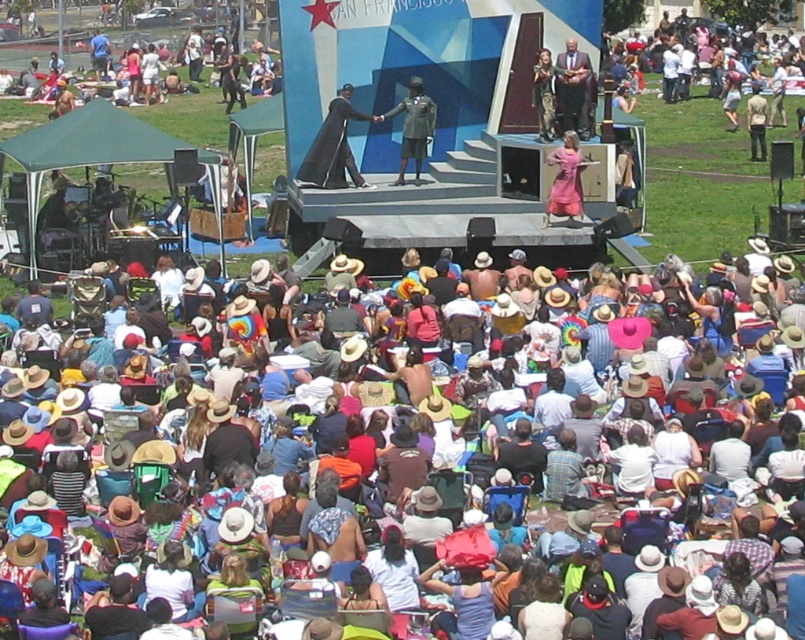
You are an event planner trying to set up a photo booth. You want to ensure that the photo booth will be visible to everyone in the crowd. Considering the brown straw hats at center and the metallic silver statue at center, which object is blocking the view for the crowd?

The metallic silver statue at center is blocking the view because the brown straw hats at center are positioned under it, meaning the statue is above the hats and could obstruct the line of sight.

You are a photographer at the event and want to capture both the smooth brown suit at center and the pink satin dress at center in a single photo. Since you can only focus on one subject at a time, which one should you choose to ensure the other remains in the background?

You should focus on the smooth brown suit at center because it is closer to you than the pink satin dress at center, so the latter will naturally appear in the background.